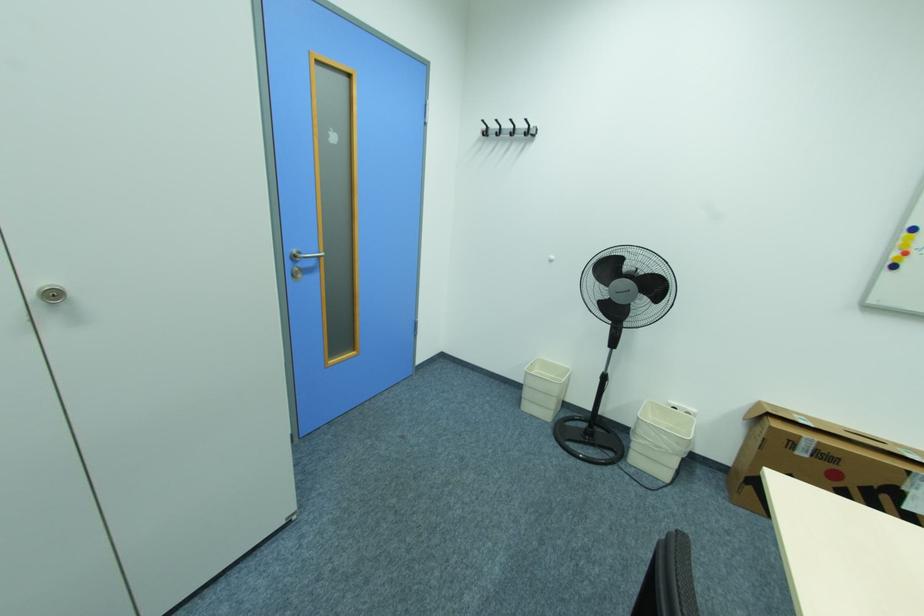
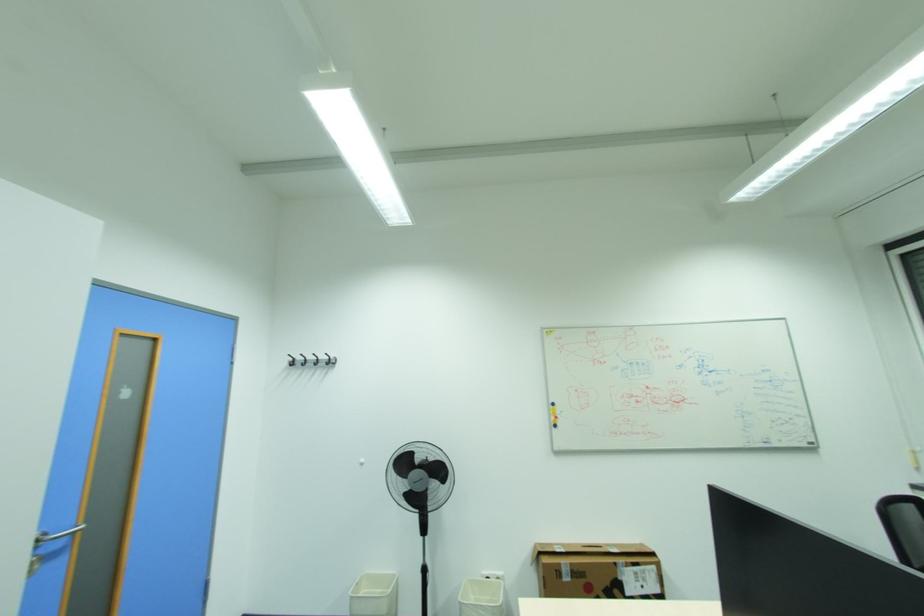
Consider the image. How did the camera likely rotate?

The camera rotated toward right-up.